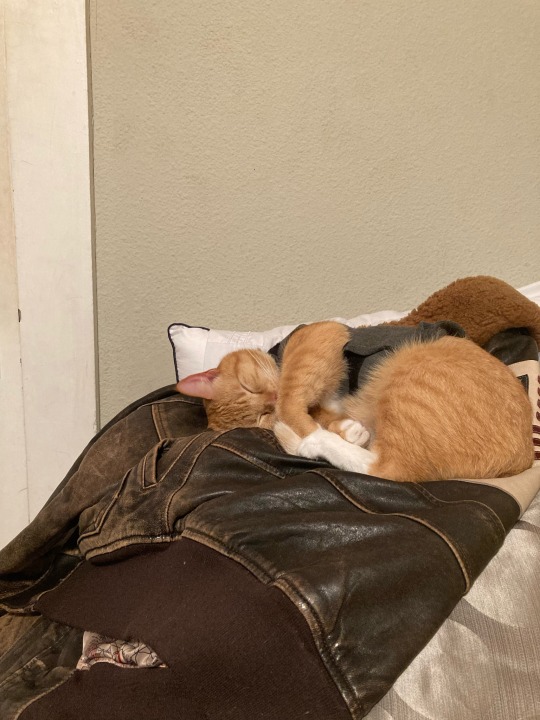
This screenshot has width=540, height=720. In order to click on blanket in this screenshot , I will do `click(459, 685)`.